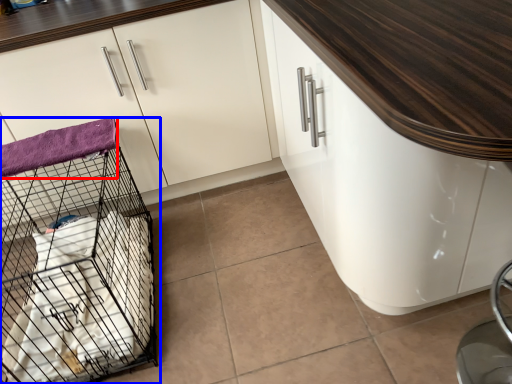
Question: Among these objects, which one is nearest to the camera, blanket (highlighted by a red box) or bird cage (highlighted by a blue box)?

Choices:
 (A) blanket
 (B) bird cage

Answer: (B)